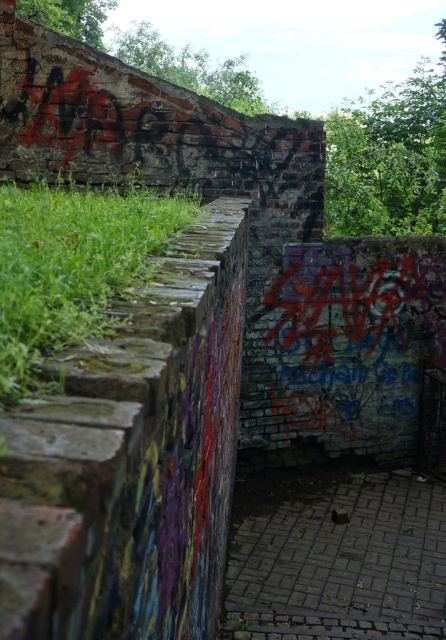
You are a delivery person with a cart that is 3 feet wide. You need to move from the dark brick path at center to the green mossy wall at left. Is there enough space between them for your cart to pass through?

The dark brick path at center is 9.47 feet from the green mossy wall at left, so yes, the cart can pass through since the distance is greater than the cart width of 3 feet.

Based on the photo, you are standing in front of the weathered brick wall with graffiti. There is a point at coordinates (338, 557). According to the scene description, where exactly is this point located?

The point at coordinates (338, 557) is located on the dark brick path at center.